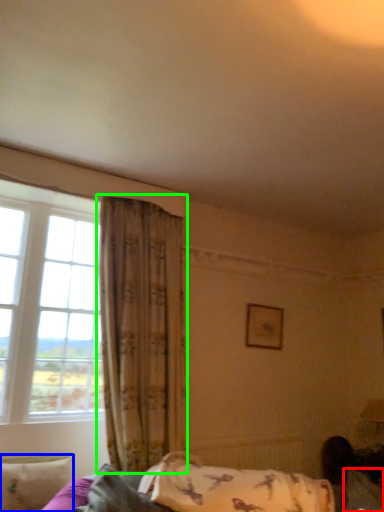
Question: Based on their relative distances, which object is nearer to pillow (highlighted by a red box)? Choose from pillow (highlighted by a blue box) and curtain (highlighted by a green box).

Choices:
 (A) pillow
 (B) curtain

Answer: (B)